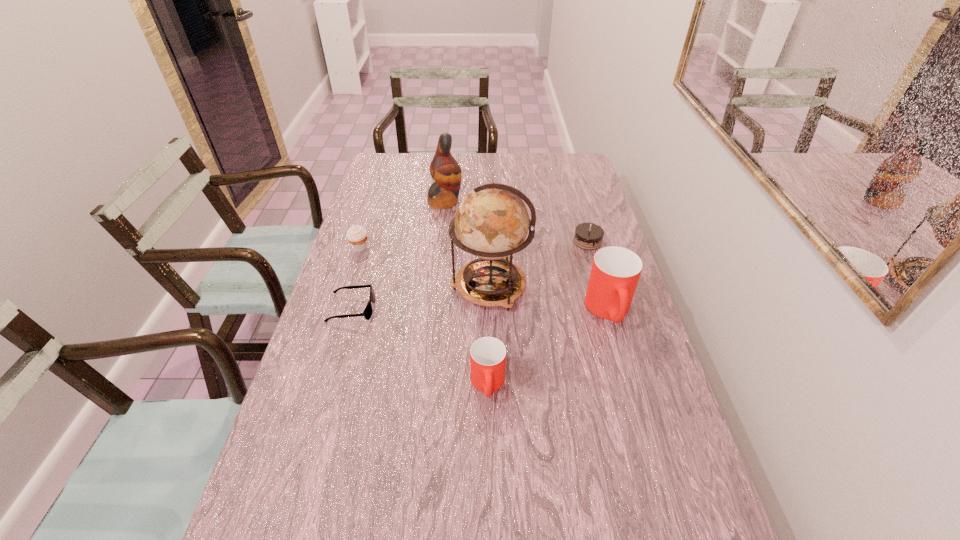
The image size is (960, 540). Identify the location of vacant region located on the side of the nearer cup with the handle. (489, 434).

Identify the location of free location located on the side of the farther cup with the handle. (652, 462).

This screenshot has width=960, height=540. I want to click on vacant space positioned at the center of the globe, so click(x=387, y=287).

You are a GUI agent. You are given a task and a screenshot of the screen. Output one action in this format:
    pyautogui.click(x=<x>, y=<y>)
    Task: Click on the free space located 0.300m at the center of the globe
    This screenshot has width=960, height=540.
    Given the screenshot: What is the action you would take?
    pyautogui.click(x=350, y=287)

Locate an element on the screen. The width and height of the screenshot is (960, 540). vacant space located at the center of the globe is located at coordinates (371, 287).

Identify the location of vacant region located on the face of the second tallest object. (560, 201).

The width and height of the screenshot is (960, 540). I want to click on vacant space located on the front of the fifth tallest object, so click(x=330, y=343).

The height and width of the screenshot is (540, 960). In order to click on blank space located on the front of the second shortest object in this screenshot , I will do `click(615, 338)`.

Identify the location of free location located on the front-facing side of the shortest object. Image resolution: width=960 pixels, height=540 pixels. (482, 309).

In order to click on muffin at the left edge in this screenshot , I will do `click(357, 236)`.